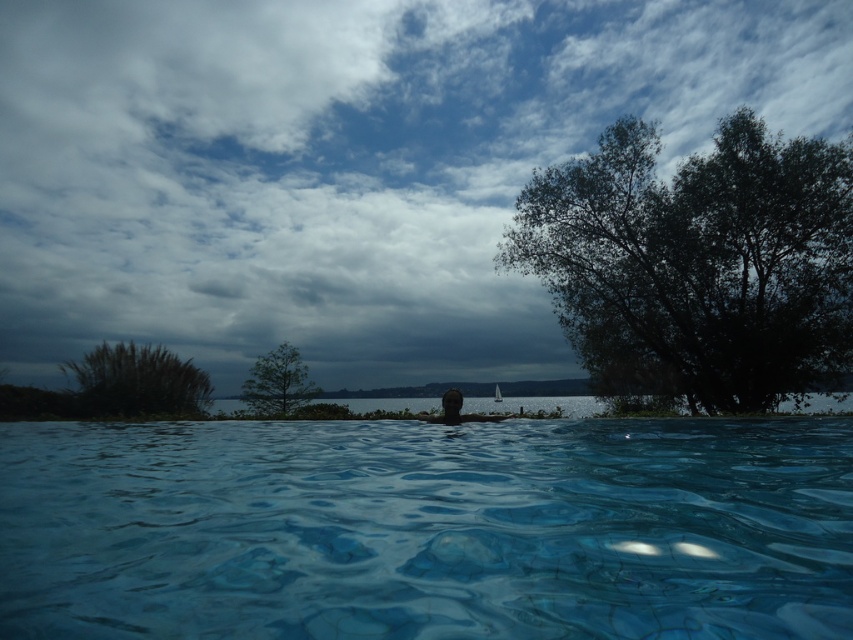
Question: Does transparent glass pool at center have a greater width compared to green grassy bush at upper left?

Choices:
 (A) yes
 (B) no

Answer: (A)

Question: Which object is farther from the camera taking this photo?

Choices:
 (A) green leafy tree at center
 (B) cloudy sky at upper center

Answer: (A)

Question: Does transparent glass pool at center appear under green grassy bush at upper left?

Choices:
 (A) yes
 (B) no

Answer: (A)

Question: Among these objects, which one is nearest to the camera?

Choices:
 (A) transparent glass pool at center
 (B) cloudy sky at upper center

Answer: (A)

Question: Does cloudy sky at upper center appear under green leafy tree at center?

Choices:
 (A) no
 (B) yes

Answer: (A)

Question: Considering the real-world distances, which object is farthest from the green leafy tree at center?

Choices:
 (A) cloudy sky at upper center
 (B) green grassy bush at upper left
 (C) green leafy tree at right
 (D) transparent glass pool at center

Answer: (C)